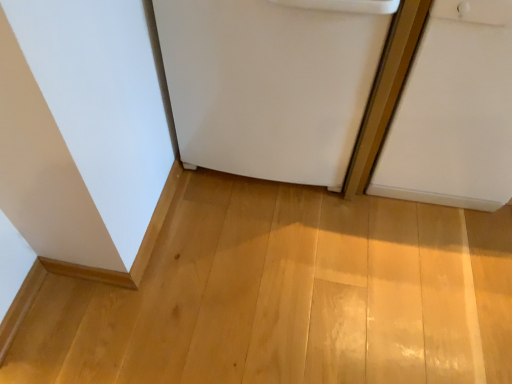
Locate an element on the screen. The width and height of the screenshot is (512, 384). white matte door at right is located at coordinates (454, 112).

The width and height of the screenshot is (512, 384). What do you see at coordinates (454, 112) in the screenshot?
I see `white matte door at right` at bounding box center [454, 112].

Describe the element at coordinates (271, 82) in the screenshot. I see `white matte refrigerator at center` at that location.

In order to face white matte refrigerator at center, should I rotate leftwards or rightwards?

You should rotate right by 3.504 degrees.

What are the coordinates of `white matte refrigerator at center` in the screenshot? It's located at (271, 82).

The height and width of the screenshot is (384, 512). What are the coordinates of `white matte door at right` in the screenshot? It's located at pos(454,112).

Can you confirm if white matte refrigerator at center is positioned to the left of white matte door at right?

Indeed, white matte refrigerator at center is positioned on the left side of white matte door at right.

Considering the relative positions of white matte refrigerator at center and white matte door at right in the image provided, is white matte refrigerator at center behind white matte door at right?

Yes, it is.

Is point (183, 30) closer or farther from the camera than point (385, 186)?

Point (183, 30) is closer to the camera than point (385, 186).

From the image's perspective, who appears lower, white matte refrigerator at center or white matte door at right?

From the image's view, white matte door at right is below.

From a real-world perspective, is white matte refrigerator at center physically below white matte door at right?

No, from a real-world perspective, white matte refrigerator at center is not under white matte door at right.

From the picture: Which object is thinner, white matte refrigerator at center or white matte door at right?

white matte door at right.

Who is shorter, white matte refrigerator at center or white matte door at right?

With less height is white matte refrigerator at center.

Which of these two, white matte refrigerator at center or white matte door at right, is bigger?

Bigger between the two is white matte refrigerator at center.

Can we say white matte refrigerator at center lies outside white matte door at right?

white matte refrigerator at center lies outside white matte door at right's area.

Can you see white matte refrigerator at center touching white matte door at right?

No, white matte refrigerator at center is not with white matte door at right.

Is white matte refrigerator at center oriented away from white matte door at right?

That's not correct — white matte refrigerator at center is not looking away from white matte door at right.

How different are the orientations of white matte refrigerator at center and white matte door at right in degrees?

They differ by 1.21e-05 degrees in their facing directions.

Where is `refrigerator above the white matte door at right (from the image's perspective)`? The width and height of the screenshot is (512, 384). refrigerator above the white matte door at right (from the image's perspective) is located at coordinates (271, 82).

Would you say white matte door at right is to the left or to the right of white matte refrigerator at center in the picture?

Based on their positions, white matte door at right is located to the right of white matte refrigerator at center.

In the scene shown: In the image, is white matte door at right positioned in front of or behind white matte refrigerator at center?

Visually, white matte door at right is located in front of white matte refrigerator at center.

Considering the points (496, 154) and (173, 64), which point is in front, point (496, 154) or point (173, 64)?

The point (173, 64) is closer.

From the image's perspective, relative to white matte refrigerator at center, is white matte door at right above or below?

white matte door at right is below white matte refrigerator at center.

From a real-world perspective, is white matte door at right positioned above or below white matte refrigerator at center?

white matte door at right is below white matte refrigerator at center.

Looking at this image, does white matte door at right have a greater width compared to white matte refrigerator at center?

No.

From their relative heights in the image, would you say white matte door at right is taller or shorter than white matte refrigerator at center?

In the image, white matte door at right appears to be taller than white matte refrigerator at center.

Does white matte door at right have a smaller size compared to white matte refrigerator at center?

Correct, white matte door at right occupies less space than white matte refrigerator at center.

Is white matte door at right situated inside white matte refrigerator at center or outside?

white matte door at right is not inside white matte refrigerator at center, it's outside.

Is white matte door at right positioned far away from white matte refrigerator at center?

Actually, white matte door at right and white matte refrigerator at center are a little close together.

Does white matte door at right turn towards white matte refrigerator at center?

No, white matte door at right does not turn towards white matte refrigerator at center.

In the scene shown: How many degrees apart are the facing directions of white matte door at right and white matte refrigerator at center?

1.21e-05 degrees.

Where is `refrigerator on the left of white matte door at right`? This screenshot has width=512, height=384. refrigerator on the left of white matte door at right is located at coordinates (271, 82).

The width and height of the screenshot is (512, 384). Identify the location of door below the white matte refrigerator at center (from the image's perspective). (454, 112).

The width and height of the screenshot is (512, 384). I want to click on door beneath the white matte refrigerator at center (from a real-world perspective), so click(x=454, y=112).